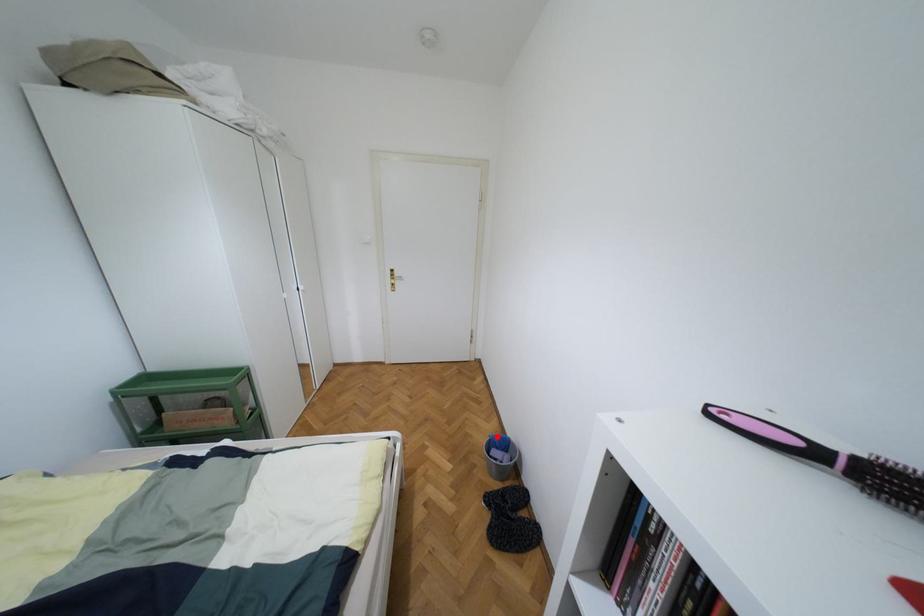
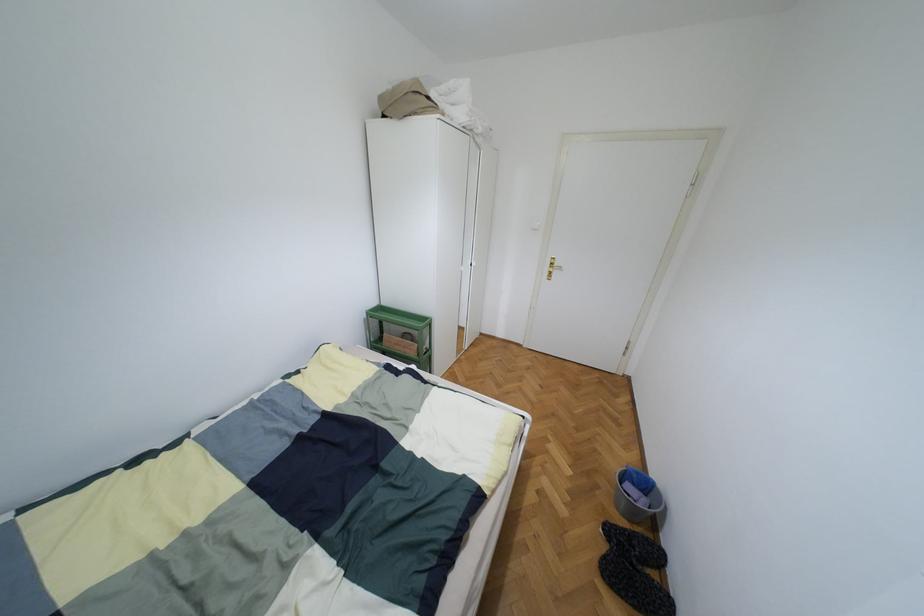
Question: I am providing you with two images of the same scene from different viewpoints. A red point is marked on the first image. Can you still see the location of the red point in image 2?

Choices:
 (A) Yes
 (B) No

Answer: (A)